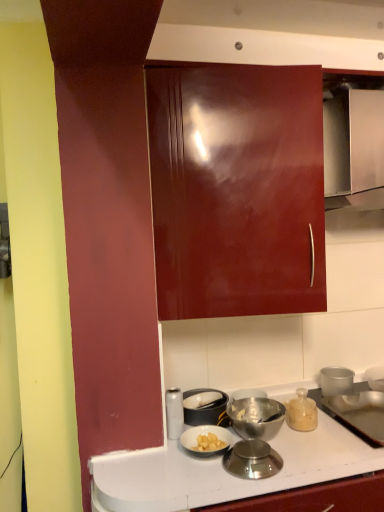
Question: From a real-world perspective, is white glossy canister at lower center, which is the 2th kitchen appliance in back-to-front order, above or below metallic silver drawer at upper right?

Choices:
 (A) below
 (B) above

Answer: (A)

Question: In the image, is white glossy canister at lower center, which is the 2th kitchen appliance in back-to-front order, positioned in front of or behind metallic silver drawer at upper right?

Choices:
 (A) front
 (B) behind

Answer: (B)

Question: Based on their relative distances, which object is nearer to the metallic silver scale at lower center, placed as the second kitchen appliance when sorted from right to left?

Choices:
 (A) matte glass jar at lower right, which ranks as the 3th kitchen appliance in left-to-right order
 (B) white glossy canister at lower center, the 1th kitchen appliance from the left
 (C) metallic silver drawer at upper right

Answer: (A)

Question: Based on their relative distances, which object is farther from the matte glass jar at lower right, which ranks as the 3th kitchen appliance in left-to-right order?

Choices:
 (A) metallic silver scale at lower center, placed as the second kitchen appliance when sorted from right to left
 (B) white glossy canister at lower center, the 1th kitchen appliance from the left
 (C) metallic silver drawer at upper right

Answer: (C)